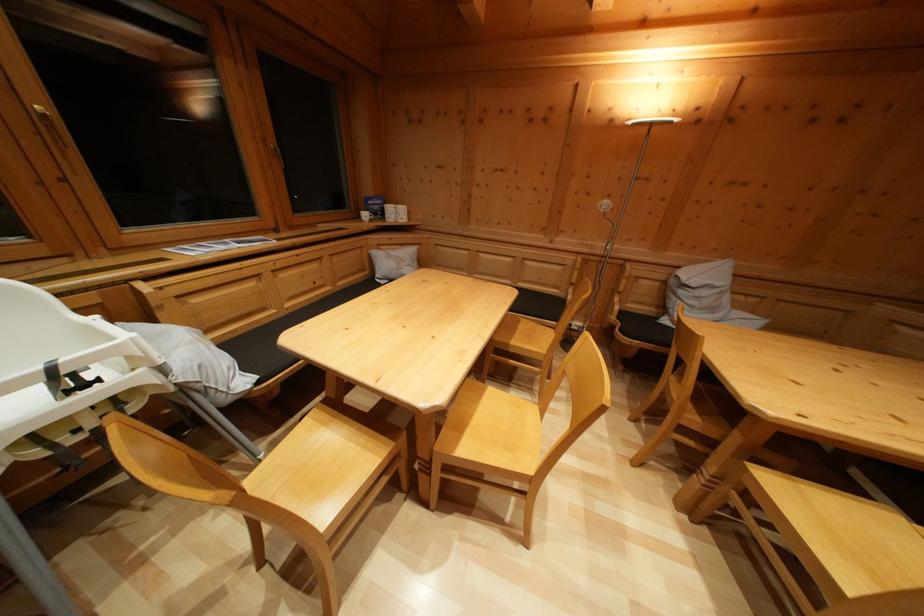
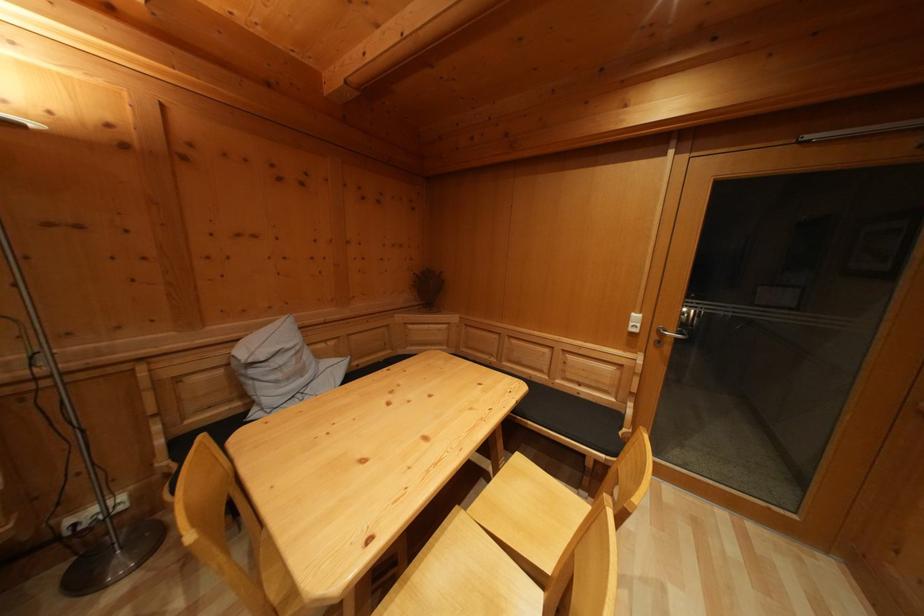
Question: Based on the continuous images, in which direction is the camera rotating? Reply with the corresponding letter.

Choices:
 (A) Left
 (B) Right
 (C) Up
 (D) Down

Answer: (B)